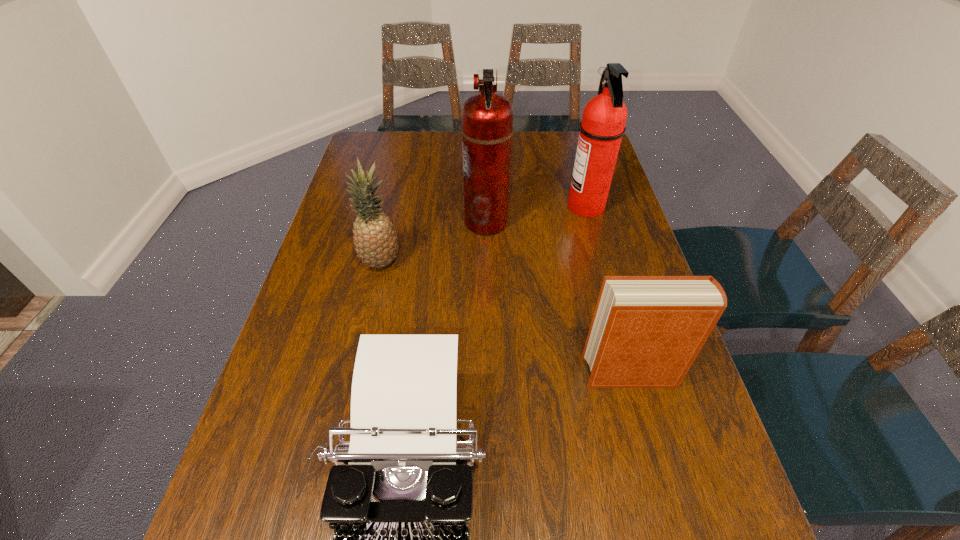
I want to click on vacant space at the far left corner of the desktop, so click(x=377, y=154).

Find the location of a particular element. This screenshot has height=540, width=960. free area in between the third farthest object and the hardback book is located at coordinates (506, 318).

Locate an element on the screen. The width and height of the screenshot is (960, 540). free spot between the right fire extinguisher and the left fire extinguisher is located at coordinates (536, 214).

Where is `vacant area that lies between the hardback book and the left fire extinguisher`? The height and width of the screenshot is (540, 960). vacant area that lies between the hardback book and the left fire extinguisher is located at coordinates (558, 298).

The image size is (960, 540). Identify the location of vacant area between the right fire extinguisher and the left fire extinguisher. (536, 214).

The height and width of the screenshot is (540, 960). I want to click on vacant area that lies between the left fire extinguisher and the third nearest object, so click(x=433, y=242).

At what (x,y) coordinates should I click in order to perform the action: click on free space between the hardback book and the left fire extinguisher. Please return your answer as a coordinate pair (x, y). Image resolution: width=960 pixels, height=540 pixels. Looking at the image, I should click on (x=558, y=298).

At what (x,y) coordinates should I click in order to perform the action: click on object that is the closest to the pineapple. Please return your answer as a coordinate pair (x, y). Image resolution: width=960 pixels, height=540 pixels. Looking at the image, I should click on (487, 118).

What are the coordinates of `object that stands as the third closest to the right fire extinguisher` in the screenshot? It's located at (375, 239).